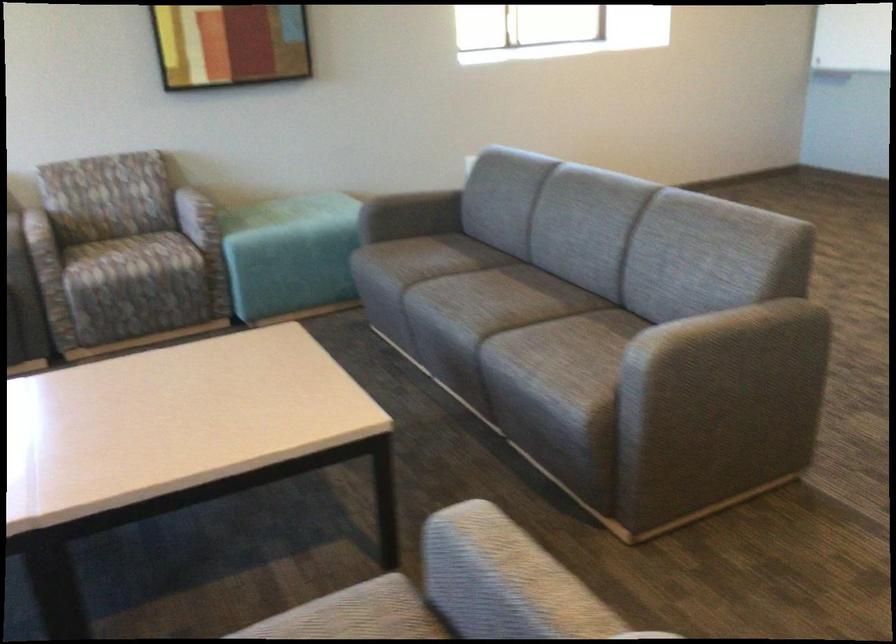
Image resolution: width=896 pixels, height=644 pixels. What are the coordinates of `patterned chair armrest` in the screenshot? It's located at (197, 216).